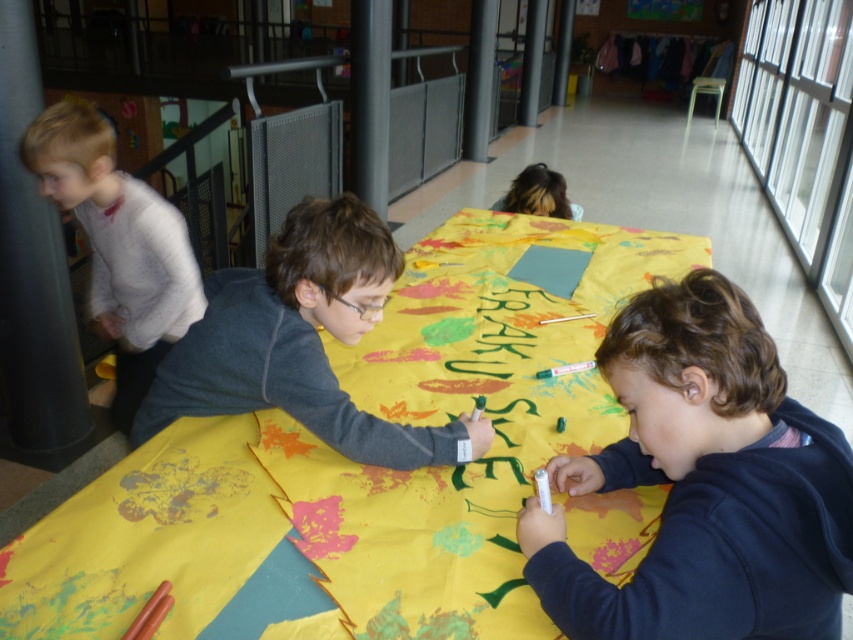
Question: Does dark gray sweater at center appear on the right side of blonde hair at upper center?

Choices:
 (A) yes
 (B) no

Answer: (B)

Question: Estimate the real-world distances between objects in this image. Which object is farther from the blonde hair at upper center?

Choices:
 (A) dark blue sweatshirt at lower right
 (B) white speckled sweater at left
 (C) yellow fabric at center

Answer: (A)

Question: Can you confirm if yellow fabric at center is positioned below dark blue sweatshirt at lower right?

Choices:
 (A) no
 (B) yes

Answer: (A)

Question: Which of the following is the farthest from the observer?

Choices:
 (A) (703, 496)
 (B) (288, 323)

Answer: (B)

Question: Which point appears closest to the camera in this image?

Choices:
 (A) (751, 406)
 (B) (474, 536)
 (C) (148, 292)

Answer: (A)

Question: Is dark gray sweater at center further to the viewer compared to white speckled sweater at left?

Choices:
 (A) yes
 (B) no

Answer: (B)